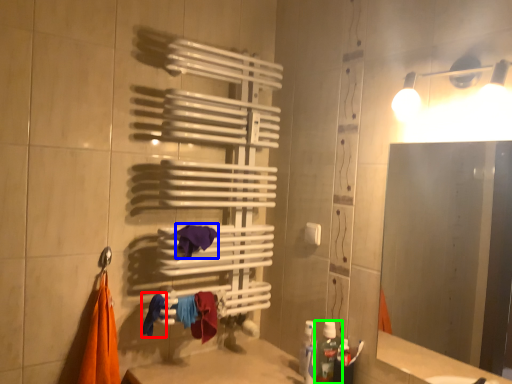
Question: Which object is the closest to the clothe (highlighted by a red box)? Choose among these: beach towel (highlighted by a blue box) or bottle (highlighted by a green box).

Choices:
 (A) beach towel
 (B) bottle

Answer: (A)